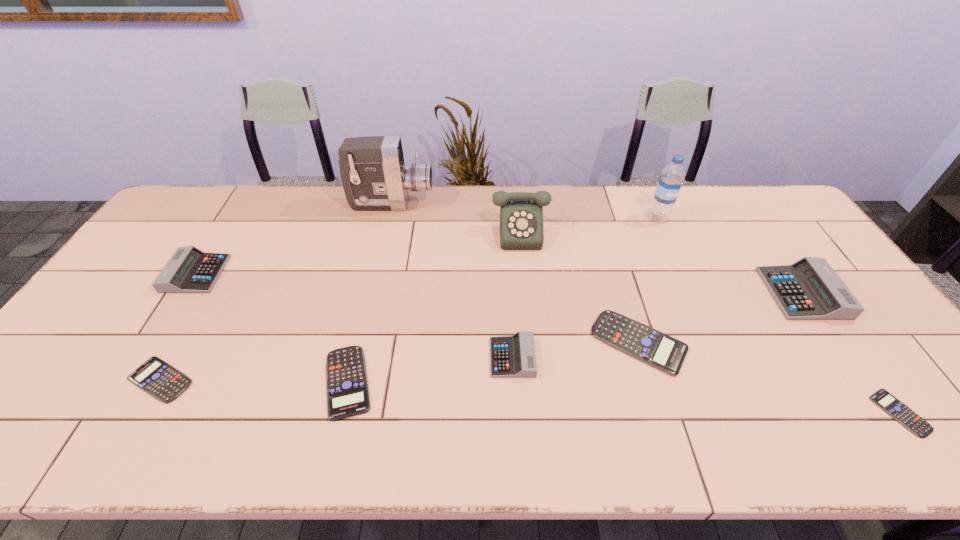
Identify the location of unoccupied position between the eighth object from left to right and the rightmost blue calculator. The image size is (960, 540). (779, 315).

This screenshot has width=960, height=540. Identify the location of free space between the nearest gray calculator and the fifth tallest object. (354, 315).

Locate an element on the screen. The width and height of the screenshot is (960, 540). blank region between the tallest calculator and the shortest calculator is located at coordinates click(851, 353).

The image size is (960, 540). In order to click on vacant area between the second smallest gray calculator and the third tallest calculator in this screenshot , I will do `click(354, 315)`.

I want to click on free area in between the camcorder and the biggest gray calculator, so click(x=597, y=248).

Identify the location of vacant point located between the smallest gray calculator and the fourth shortest object. (576, 350).

Where is `object that stands as the second closest to the second smallest gray calculator`? The height and width of the screenshot is (540, 960). object that stands as the second closest to the second smallest gray calculator is located at coordinates (374, 176).

The height and width of the screenshot is (540, 960). Find the location of `object identified as the fourth closest to the camcorder`. object identified as the fourth closest to the camcorder is located at coordinates (514, 356).

Choose which calculator is the nearest neighbor to the fifth shortest object. Please provide its 2D coordinates. Your answer should be formatted as a tuple, i.e. [(x, y)], where the tuple contains the x and y coordinates of a point satisfying the conditions above.

[(661, 351)]

The image size is (960, 540). What are the coordinates of `calculator that stands as the fourth closest to the shortest calculator` in the screenshot? It's located at (346, 377).